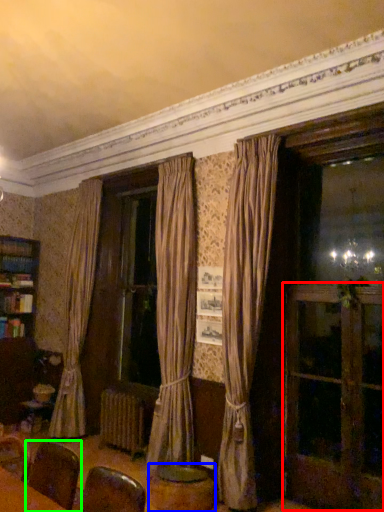
Question: Based on their relative distances, which object is nearer to screen door (highlighted by a red box)? Choose from round table (highlighted by a blue box) and armchair (highlighted by a green box).

Choices:
 (A) round table
 (B) armchair

Answer: (A)